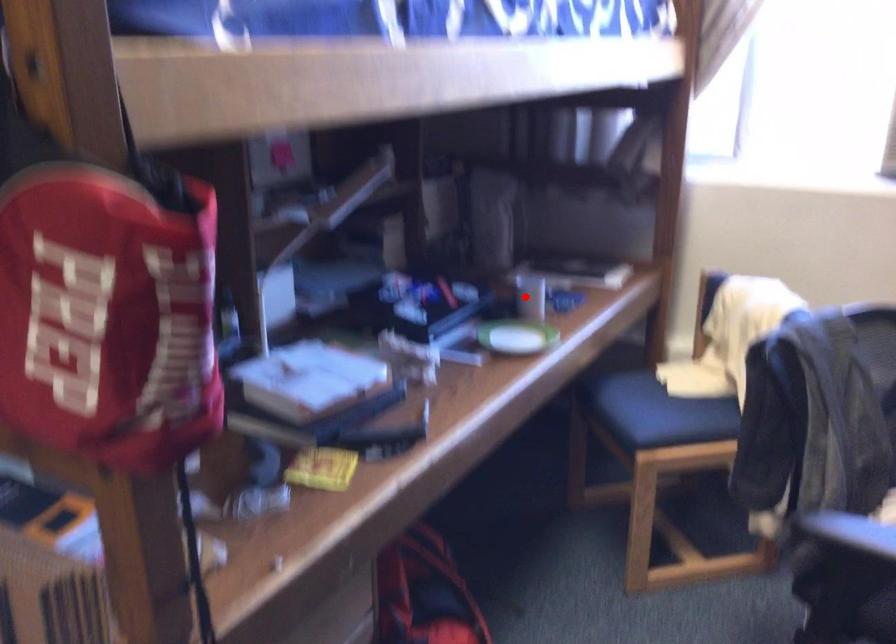
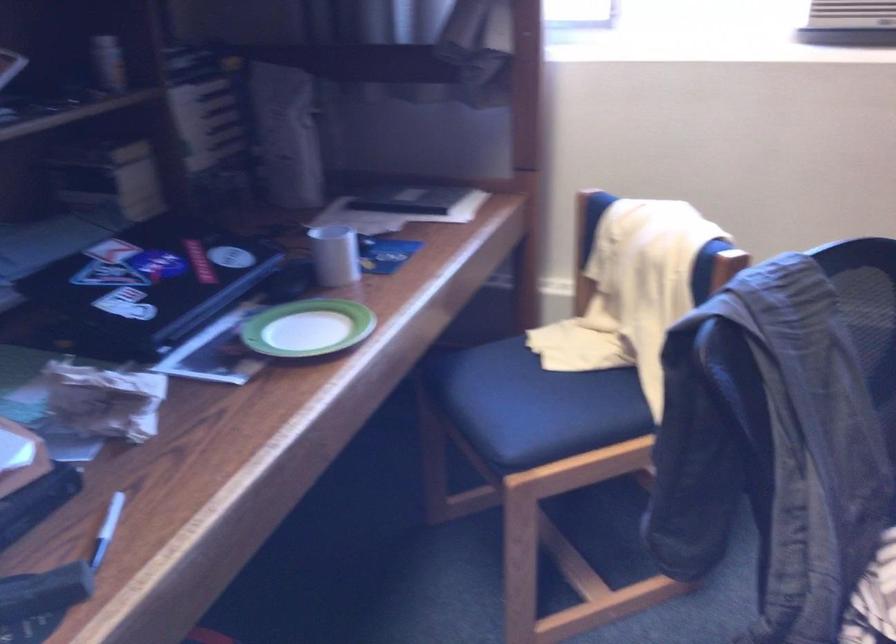
Question: I am providing you with two images of the same scene from different viewpoints. A red point is marked on the first image. Is the red point's position out of view in image 2?

Choices:
 (A) Yes
 (B) No

Answer: (B)